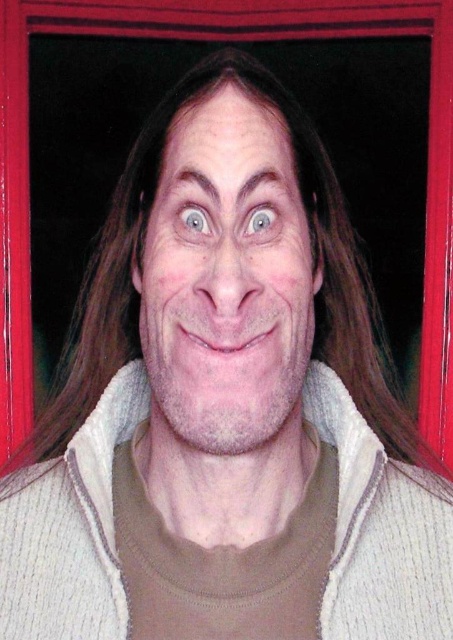
Which of these two, light blue glossy eye at center or blue glossy eye at center, stands taller?

blue glossy eye at center

Is point (260, 209) positioned before point (187, 212)?

Yes, it is.

Is point (269, 227) positioned in front of point (202, 230)?

No, it is behind (202, 230).

The height and width of the screenshot is (640, 453). What are the coordinates of `light blue glossy eye at center` in the screenshot? It's located at (260, 220).

Who is higher up, smooth skin face at center or white textured sweater at center?

smooth skin face at center is higher up.

In the scene shown: Is smooth skin face at center wider than white textured sweater at center?

In fact, smooth skin face at center might be narrower than white textured sweater at center.

Is point (284, 339) positioned after point (389, 582)?

No, it is in front of (389, 582).

I want to click on smooth skin face at center, so click(x=226, y=284).

Who is positioned more to the left, smooth skin face at center or light blue glossy eye at center?

Positioned to the left is smooth skin face at center.

Can you confirm if smooth skin face at center is positioned to the left of light blue glossy eye at center?

Indeed, smooth skin face at center is positioned on the left side of light blue glossy eye at center.

At what (x,y) coordinates should I click in order to perform the action: click on smooth skin face at center. Please return your answer as a coordinate pair (x, y). The image size is (453, 640). Looking at the image, I should click on (226, 284).